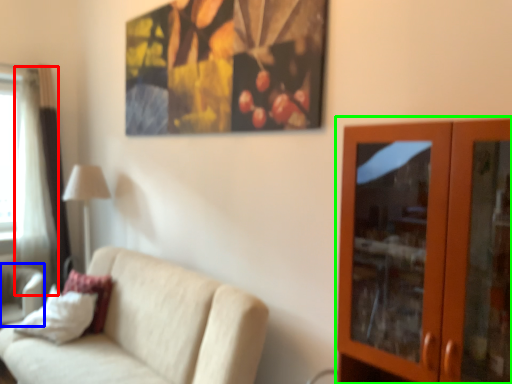
Question: Which is nearer to the curtain (highlighted by a red box)? swivel chair (highlighted by a blue box) or dresser (highlighted by a green box).

Choices:
 (A) swivel chair
 (B) dresser

Answer: (A)